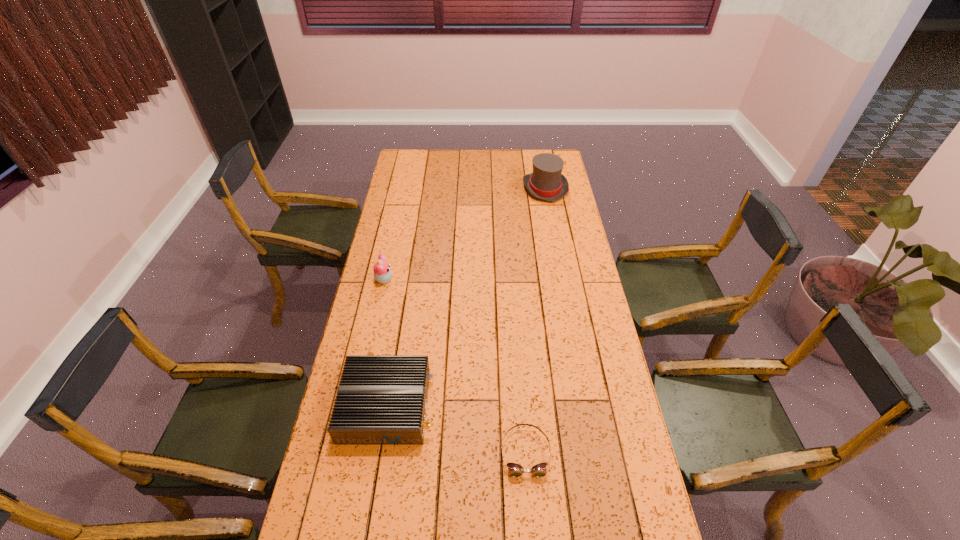
This screenshot has height=540, width=960. I want to click on the tallest object, so click(546, 182).

At what (x,y) coordinates should I click in order to perform the action: click on the rightmost object. Please return your answer as a coordinate pair (x, y). The height and width of the screenshot is (540, 960). Looking at the image, I should click on (546, 182).

Find the location of a particular element. The height and width of the screenshot is (540, 960). cupcake is located at coordinates (382, 273).

This screenshot has width=960, height=540. In order to click on router in this screenshot , I will do `click(381, 400)`.

The width and height of the screenshot is (960, 540). What are the coordinates of `the third object from left to right` in the screenshot? It's located at (514, 470).

Locate an element on the screen. the shortest object is located at coordinates (514, 470).

The width and height of the screenshot is (960, 540). What are the coordinates of `vacant space located on the front of the dress hat` in the screenshot? It's located at (550, 217).

The height and width of the screenshot is (540, 960). I want to click on free spot located 0.200m on the face of the cupcake, so click(x=443, y=280).

The width and height of the screenshot is (960, 540). Find the location of `vacant space located on the back panel of the router`. vacant space located on the back panel of the router is located at coordinates (495, 406).

This screenshot has height=540, width=960. I want to click on free space located 0.070m through the lenses of the second object from right to left, so click(529, 505).